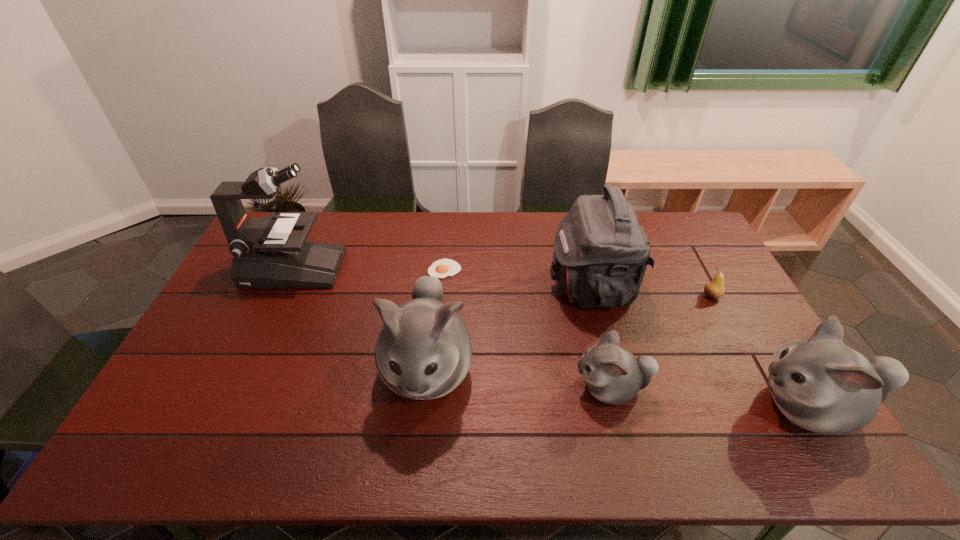
Identify the location of the closest hamster to the fourth tallest object. The width and height of the screenshot is (960, 540). (613, 375).

Identify the location of free space that satisfies the following two spatial constraints: 1. on the back side of the sixth tallest object; 2. on the open flap of the shoulder bag. The width and height of the screenshot is (960, 540). (706, 286).

Where is `vacant point that satisfies the following two spatial constraints: 1. on the front side of the egg yolk; 2. through the eyepieces of the microscope`? The width and height of the screenshot is (960, 540). vacant point that satisfies the following two spatial constraints: 1. on the front side of the egg yolk; 2. through the eyepieces of the microscope is located at coordinates (444, 269).

At what (x,y) coordinates should I click in order to perform the action: click on vacant point that satisfies the following two spatial constraints: 1. through the eyepieces of the leftmost object; 2. on the back side of the sixth tallest object. Please return your answer as a coordinate pair (x, y). Looking at the image, I should click on (281, 296).

Find the location of `vacant space that satisfies the following two spatial constraints: 1. through the eyepieces of the pear; 2. on the left side of the microscope`. vacant space that satisfies the following two spatial constraints: 1. through the eyepieces of the pear; 2. on the left side of the microscope is located at coordinates (281, 296).